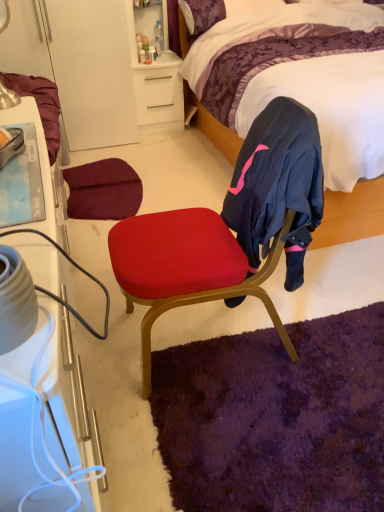
Question: From a real-world perspective, relative to brushed metal table lamp at upper left, is purple shag rug at lower center vertically above or below?

Choices:
 (A) below
 (B) above

Answer: (A)

Question: Is purple shag rug at lower center wider or thinner than brushed metal table lamp at upper left?

Choices:
 (A) wide
 (B) thin

Answer: (A)

Question: Which of these objects is positioned closest to the purple shag rug at lower center?

Choices:
 (A) velvet purple bed at upper right
 (B) velvet red chair at center
 (C) white matte desk at upper center
 (D) matte black sneakers at upper left
 (E) white plastic cabinet at left

Answer: (B)

Question: Which of these objects is positioned farthest from the brushed metal table lamp at upper left?

Choices:
 (A) velvet red chair at center
 (B) white matte desk at upper center
 (C) velvet purple bed at upper right
 (D) white plastic cabinet at left
 (E) purple shag rug at lower center

Answer: (B)